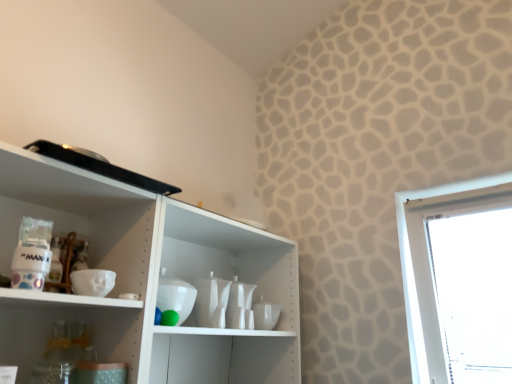
Question: From a real-world perspective, is white glossy vase at center, acting as the second tableware starting from the right, above or below white glossy cup at center, which is the 1th tableware from right to left?

Choices:
 (A) above
 (B) below

Answer: (A)

Question: Is white glossy vase at center, marked as the first tableware in a left-to-right arrangement, inside or outside of white glossy cup at center, the 2th tableware in the front-to-back sequence?

Choices:
 (A) outside
 (B) inside

Answer: (A)

Question: Considering their positions, is white glossy vase at center, marked as the first tableware in a left-to-right arrangement, located in front of or behind white glossy cup at center, which is the 1th tableware from right to left?

Choices:
 (A) front
 (B) behind

Answer: (A)

Question: Considering the positions of white glossy cup at center, the 2th tableware in the front-to-back sequence, and white glossy vase at center, acting as the second tableware starting from the right, in the image, is white glossy cup at center, the 2th tableware in the front-to-back sequence, wider or thinner than white glossy vase at center, acting as the second tableware starting from the right,?

Choices:
 (A) wide
 (B) thin

Answer: (B)

Question: Considering the positions of white glossy cup at center, which is the 1th tableware from right to left, and white glossy vase at center, acting as the 1th tableware starting from the front, in the image, is white glossy cup at center, which is the 1th tableware from right to left, taller or shorter than white glossy vase at center, acting as the 1th tableware starting from the front,?

Choices:
 (A) tall
 (B) short

Answer: (B)

Question: Considering the positions of point (269, 321) and point (199, 306), is point (269, 321) closer or farther from the camera than point (199, 306)?

Choices:
 (A) farther
 (B) closer

Answer: (A)

Question: From the image's perspective, is white glossy cup at center, the first tableware viewed from the back, located above or below white glossy vase at center, which is the second tableware from back to front?

Choices:
 (A) above
 (B) below

Answer: (B)